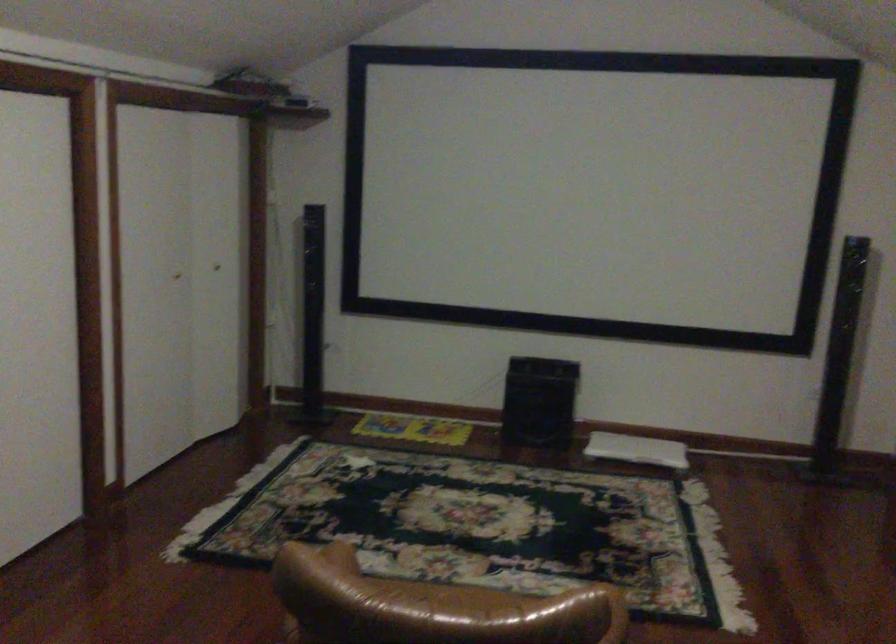
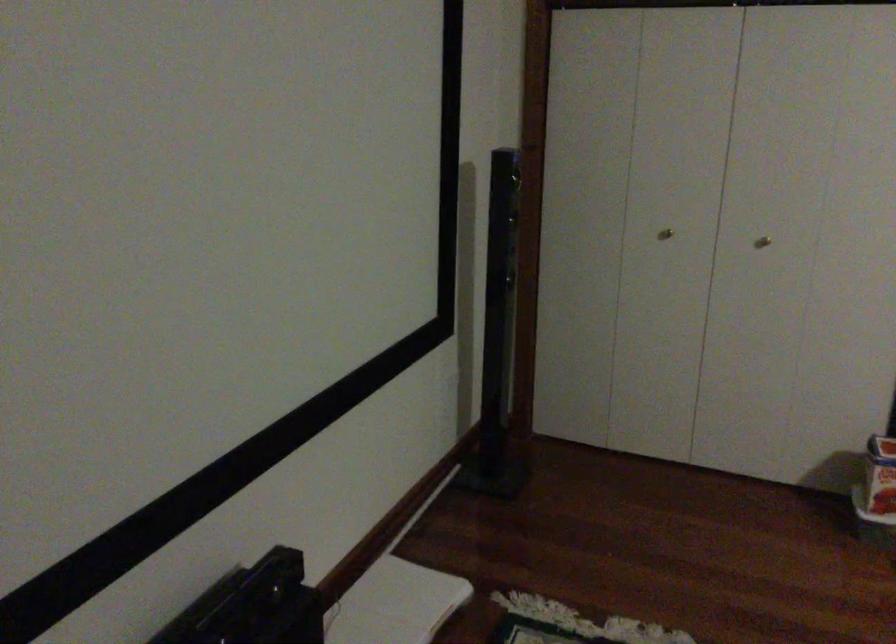
Find the pixel in the second image that matches (x=659, y=446) in the first image.

(394, 603)